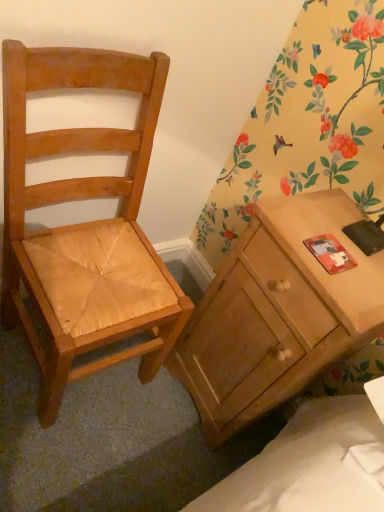
Question: In terms of size, does light brown wood chair at left appear bigger or smaller than matte wood desk at right?

Choices:
 (A) big
 (B) small

Answer: (A)

Question: Does point (54, 286) appear closer or farther from the camera than point (271, 269)?

Choices:
 (A) closer
 (B) farther

Answer: (B)

Question: Is light brown wood chair at left taller or shorter than matte wood desk at right?

Choices:
 (A) short
 (B) tall

Answer: (B)

Question: Based on their sizes in the image, would you say matte wood desk at right is bigger or smaller than light brown wood chair at left?

Choices:
 (A) big
 (B) small

Answer: (B)

Question: From their relative heights in the image, would you say matte wood desk at right is taller or shorter than light brown wood chair at left?

Choices:
 (A) short
 (B) tall

Answer: (A)

Question: In the image, is matte wood desk at right on the left side or the right side of light brown wood chair at left?

Choices:
 (A) left
 (B) right

Answer: (B)

Question: In terms of width, does matte wood desk at right look wider or thinner when compared to light brown wood chair at left?

Choices:
 (A) wide
 (B) thin

Answer: (B)